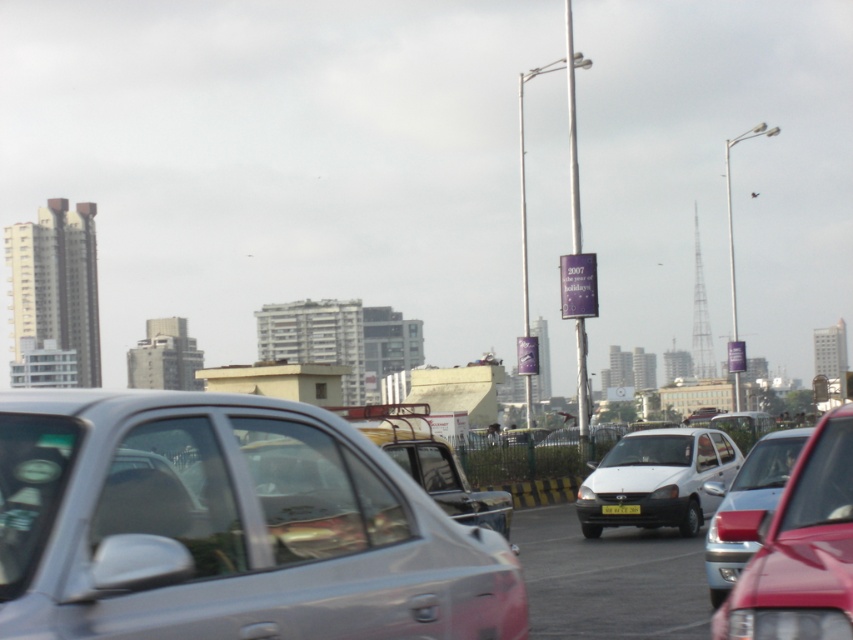
You are a driver trying to navigate through the traffic in the busy urban scene. You see the silver metallic car at center and the metallic silver sedan at center. Which vehicle should you avoid if you need to pass through a narrow alley that can only accommodate smaller vehicles?

You should avoid the metallic silver sedan at center because the silver metallic car at center is smaller and would fit better in the narrow alley.

Consider the image. You are a delivery driver navigating through the busy urban scene. You need to deliver a package to a location marked by point [672,460]. However, there is an obstacle at point [30,412]. Can you safely go around the obstacle to reach your destination?

Point [30,412] is in front of point [672,460], so you cannot safely go around the obstacle to reach the destination because the obstacle is blocking the path.

You are a delivery person trying to decide which vehicle to park behind to avoid blocking the sun from the next driver. The silver metallic car at center and the white matte sedan at center are both options. Which vehicle should you choose to park behind?

The silver metallic car at center has a lesser height compared to the white matte sedan at center, so parking behind the white matte sedan at center will provide more coverage and reduce the chance of blocking the sun for the driver behind you.